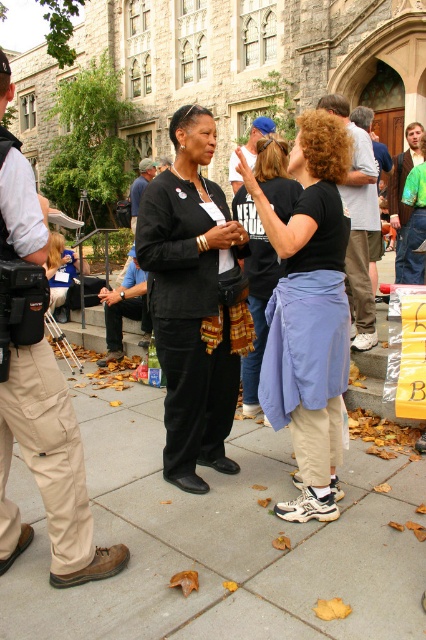
Question: Does gray concrete pavement at center appear on the left side of matte black shirt at center?

Choices:
 (A) yes
 (B) no

Answer: (A)

Question: Does green t-shirt at center come behind dark blue shirt at center?

Choices:
 (A) no
 (B) yes

Answer: (A)

Question: Which point is farther to the camera?

Choices:
 (A) black matte pants at center
 (B) blue fabric cap at center

Answer: (B)

Question: Considering the relative positions of gray concrete pavement at center and black matte pants at center in the image provided, where is gray concrete pavement at center located with respect to black matte pants at center?

Choices:
 (A) below
 (B) above

Answer: (A)

Question: Which point is farther to the camera?

Choices:
 (A) (331, 141)
 (B) (261, 228)
 (C) (331, 540)

Answer: (B)

Question: Which object appears closest to the camera in this image?

Choices:
 (A) gray concrete pavement at center
 (B) khaki cargo pants at left
 (C) matte black shirt at center

Answer: (A)